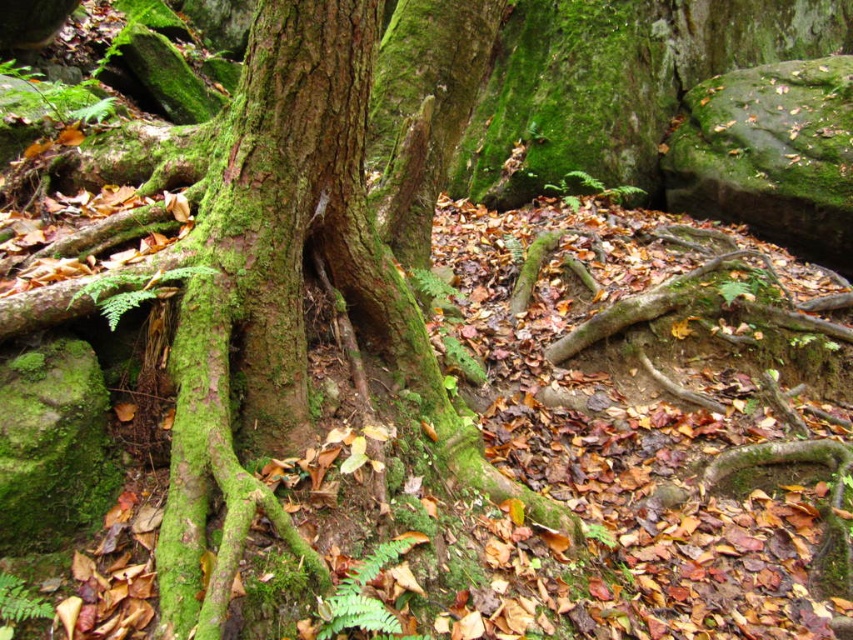
Question: Can you confirm if green mossy tree roots at center is smaller than green matte fern at center?

Choices:
 (A) no
 (B) yes

Answer: (A)

Question: Estimate the real-world distances between objects in this image. Which object is farther from the green mossy tree trunk at center?

Choices:
 (A) green matte fern at center
 (B) green mossy tree roots at center

Answer: (A)

Question: Which is nearer to the green mossy tree trunk at center?

Choices:
 (A) green mossy tree roots at center
 (B) green matte fern at center

Answer: (A)

Question: Does green mossy tree roots at center have a smaller size compared to green mossy tree trunk at center?

Choices:
 (A) yes
 (B) no

Answer: (B)

Question: Which object appears farthest from the camera in this image?

Choices:
 (A) green mossy tree roots at center
 (B) green mossy tree trunk at center

Answer: (A)

Question: Is green mossy tree trunk at center bigger than green matte fern at center?

Choices:
 (A) yes
 (B) no

Answer: (A)